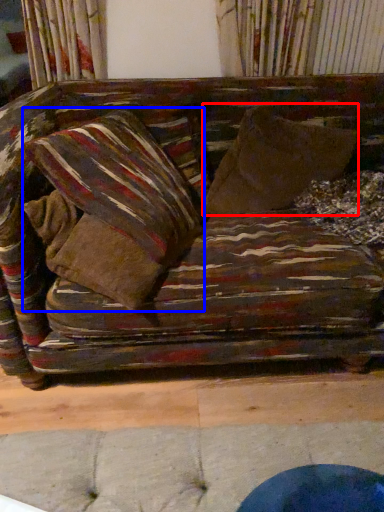
Question: Which object appears closest to the camera in this image, throw pillow (highlighted by a red box) or pillow (highlighted by a blue box)?

Choices:
 (A) throw pillow
 (B) pillow

Answer: (B)